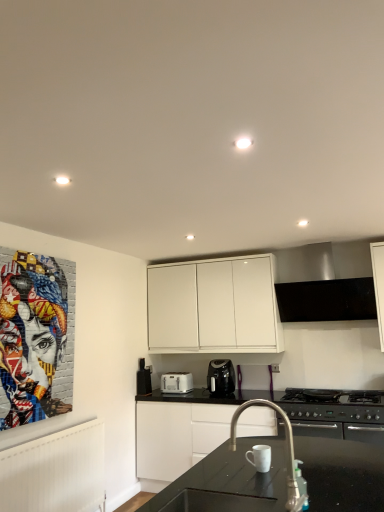
Question: Could satin silver exhaust hood at upper center be considered to be inside black plastic toaster at lower center, acting as the first appliance starting from the bottom?

Choices:
 (A) yes
 (B) no

Answer: (B)

Question: From the image's perspective, is black plastic toaster at lower center, placed as the 2th appliance when sorted from right to left, located above satin silver exhaust hood at upper center?

Choices:
 (A) no
 (B) yes

Answer: (A)

Question: Is black plastic toaster at lower center, the second appliance viewed from the top, thinner than satin silver exhaust hood at upper center?

Choices:
 (A) yes
 (B) no

Answer: (A)

Question: Is black plastic toaster at lower center, which is the 2th appliance in front-to-back order, facing away from satin silver exhaust hood at upper center?

Choices:
 (A) yes
 (B) no

Answer: (B)

Question: Can you confirm if black plastic toaster at lower center, which is the 2th appliance in front-to-back order, is shorter than satin silver exhaust hood at upper center?

Choices:
 (A) no
 (B) yes

Answer: (B)

Question: Is black plastic toaster at lower center, which is the 2th appliance in front-to-back order, positioned far away from satin silver exhaust hood at upper center?

Choices:
 (A) no
 (B) yes

Answer: (B)

Question: Is black glossy sink at center surrounded by satin silver exhaust hood at upper center?

Choices:
 (A) no
 (B) yes

Answer: (A)

Question: From a real-world perspective, is satin silver exhaust hood at upper center on top of black glossy sink at center?

Choices:
 (A) yes
 (B) no

Answer: (A)

Question: Can you confirm if satin silver exhaust hood at upper center is shorter than black glossy sink at center?

Choices:
 (A) no
 (B) yes

Answer: (A)

Question: From the image's perspective, is satin silver exhaust hood at upper center below black glossy sink at center?

Choices:
 (A) no
 (B) yes

Answer: (A)

Question: Does satin silver exhaust hood at upper center have a lesser width compared to black glossy sink at center?

Choices:
 (A) no
 (B) yes

Answer: (B)

Question: Can we say satin silver exhaust hood at upper center lies outside black glossy sink at center?

Choices:
 (A) yes
 (B) no

Answer: (A)

Question: Does satin nickel faucet at center have a larger size compared to colorful mosaic portrait at left?

Choices:
 (A) no
 (B) yes

Answer: (A)